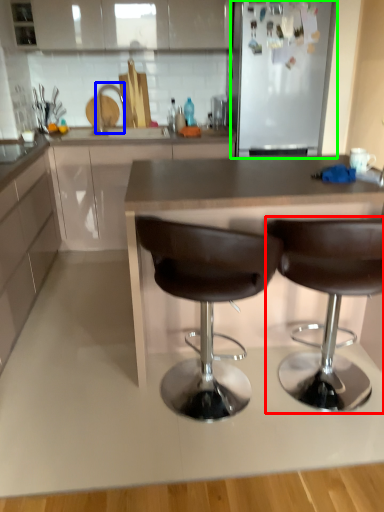
Question: Which object is positioned farthest from chair (highlighted by a red box)? Select from silver (highlighted by a blue box) and appliance (highlighted by a green box).

Choices:
 (A) silver
 (B) appliance

Answer: (A)